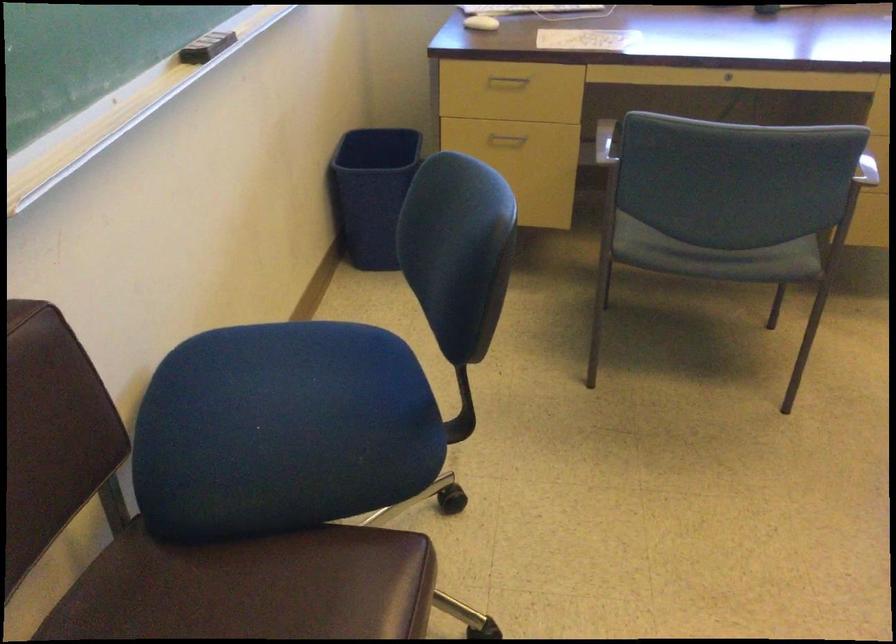
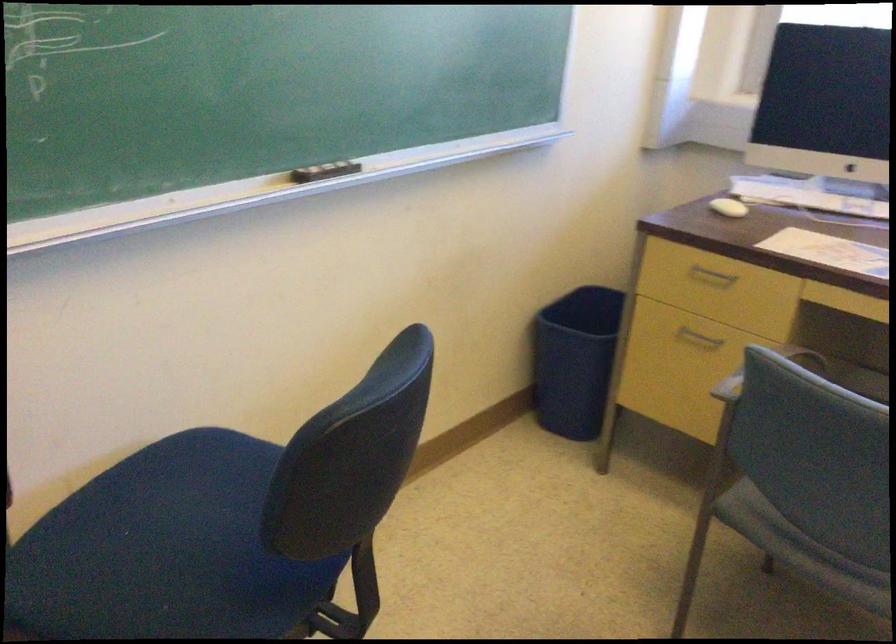
Locate, in the second image, the point that corresponds to the point at 642,127 in the first image.

(764, 371)